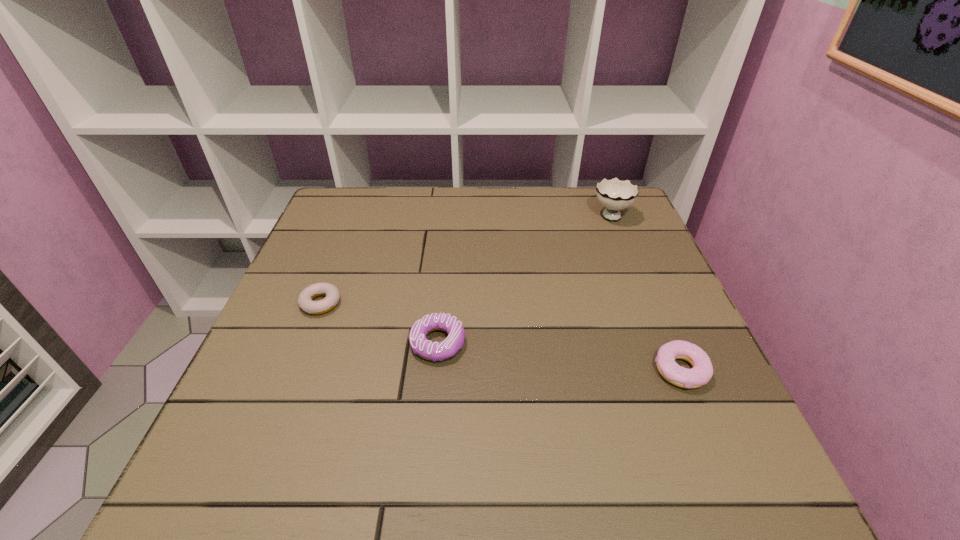
Where is `vacant area between the rightmost doughnut and the second object from left to right`? This screenshot has width=960, height=540. vacant area between the rightmost doughnut and the second object from left to right is located at coordinates tap(560, 356).

Point out which object is positioned as the third nearest to the rightmost doughnut. Please provide its 2D coordinates. Your answer should be formatted as a tuple, i.e. [(x, y)], where the tuple contains the x and y coordinates of a point satisfying the conditions above.

[(332, 294)]

Identify which object is the closest to the second doughnut from left to right. Please provide its 2D coordinates. Your answer should be formatted as a tuple, i.e. [(x, y)], where the tuple contains the x and y coordinates of a point satisfying the conditions above.

[(332, 294)]

Select which doughnut is the closest to the shortest doughnut. Please provide its 2D coordinates. Your answer should be formatted as a tuple, i.e. [(x, y)], where the tuple contains the x and y coordinates of a point satisfying the conditions above.

[(433, 351)]

Image resolution: width=960 pixels, height=540 pixels. I want to click on the closest doughnut to the rightmost doughnut, so click(433, 351).

Locate an element on the screen. vacant area in the image that satisfies the following two spatial constraints: 1. on the front side of the leftmost object; 2. on the right side of the third object from right to left is located at coordinates [x=305, y=343].

You are a GUI agent. You are given a task and a screenshot of the screen. Output one action in this format:
    pyautogui.click(x=<x>, y=<y>)
    Task: Click on the free spot that satisfies the following two spatial constraints: 1. on the front side of the rightmost doughnut; 2. on the left side of the second doughnut from left to right
    This screenshot has height=540, width=960.
    Given the screenshot: What is the action you would take?
    pyautogui.click(x=435, y=370)

Find the location of a particular element. Image resolution: width=960 pixels, height=540 pixels. free space that satisfies the following two spatial constraints: 1. on the front side of the second doughnut from right to left; 2. on the right side of the third nearest object is located at coordinates (305, 343).